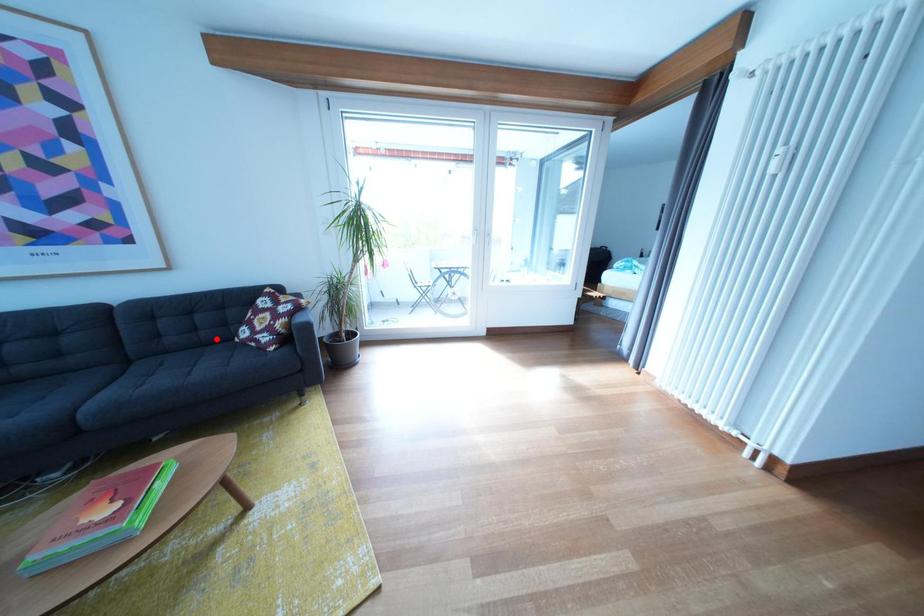
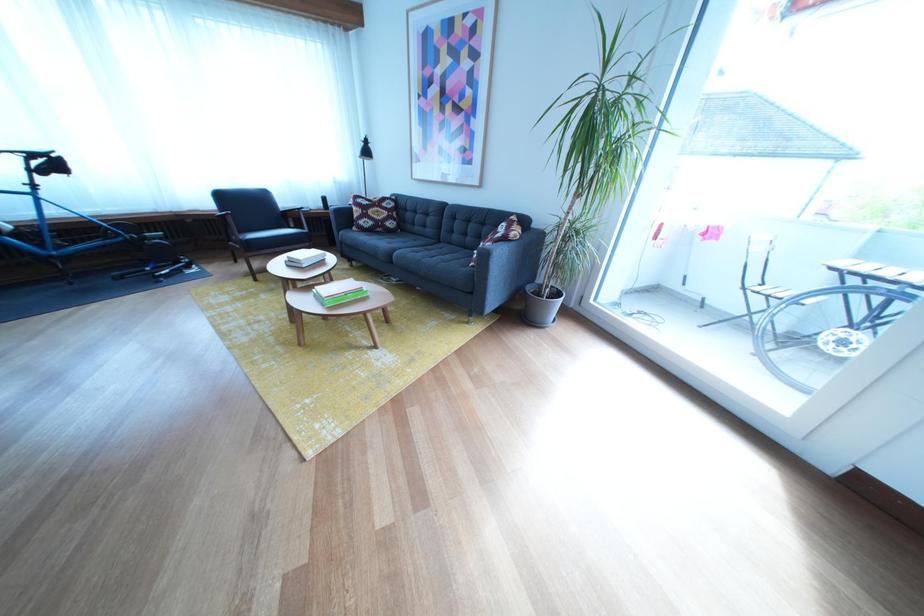
Locate, in the second image, the point that corresponds to the highlighted location in the first image.

(481, 245)